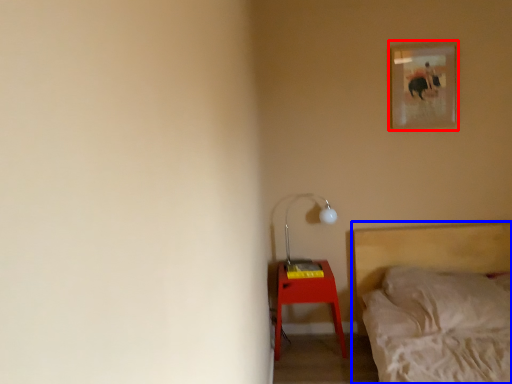
Question: Which object is closer to the camera taking this photo, picture frame (highlighted by a red box) or bed (highlighted by a blue box)?

Choices:
 (A) picture frame
 (B) bed

Answer: (B)